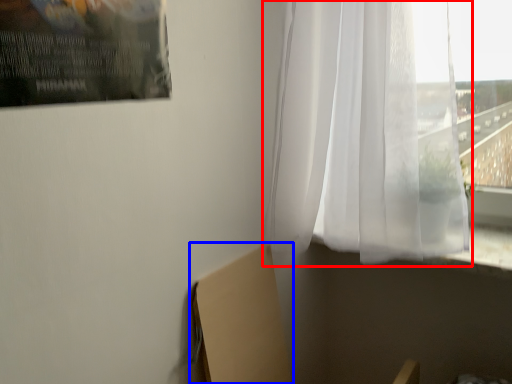
Question: Which object is closer to the camera taking this photo, curtain (highlighted by a red box) or cardboard box (highlighted by a blue box)?

Choices:
 (A) curtain
 (B) cardboard box

Answer: (A)